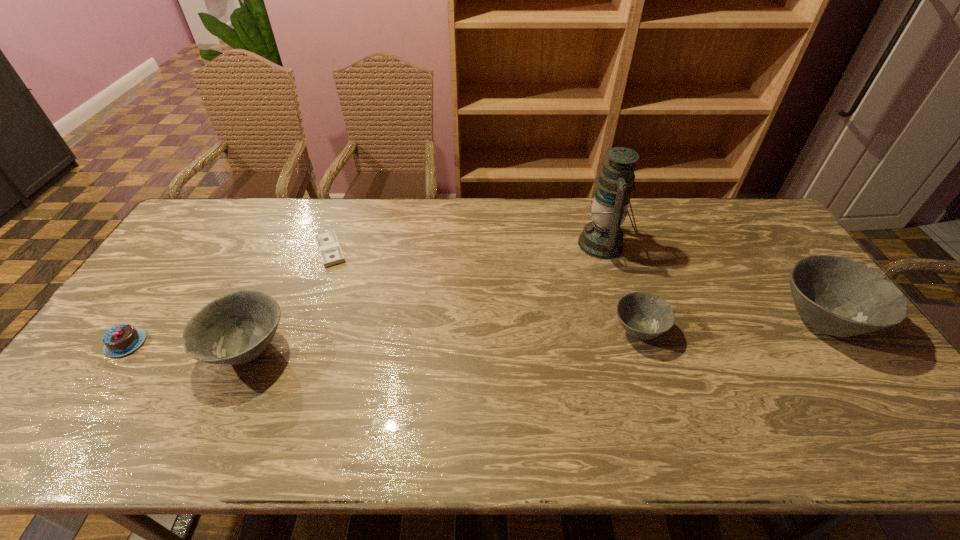
Please point a location where one more bowl can be added evenly. Please provide its 2D coordinates. Your answer should be formatted as a tuple, i.e. [(x, y)], where the tuple contains the x and y coordinates of a point satisfying the conditions above.

[(447, 340)]